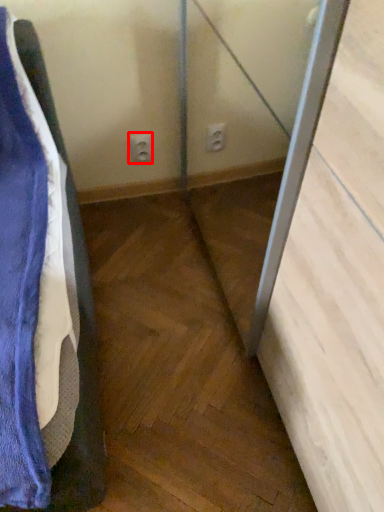
Question: Where is electric outlet (annotated by the red box) located in relation to screen door in the image?

Choices:
 (A) left
 (B) right

Answer: (A)